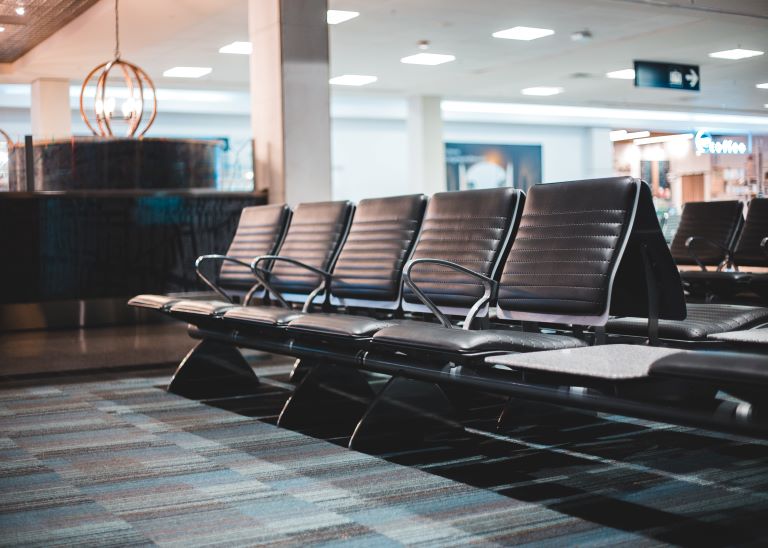
At what (x,y) coordinates should I click in order to perform the action: click on ceiling. Please return your answer as a coordinate pair (x, y). The height and width of the screenshot is (548, 768). Looking at the image, I should click on (432, 18).